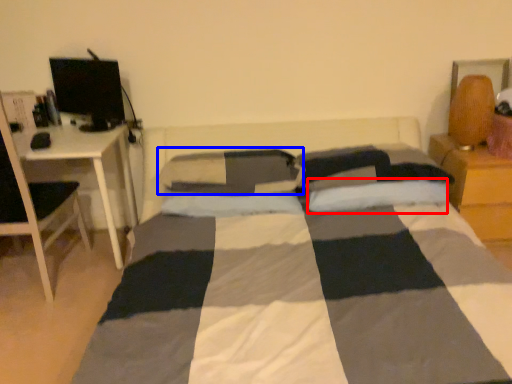
Question: Which of the following is the closest to the observer, pillow (highlighted by a red box) or pillow (highlighted by a blue box)?

Choices:
 (A) pillow
 (B) pillow

Answer: (A)